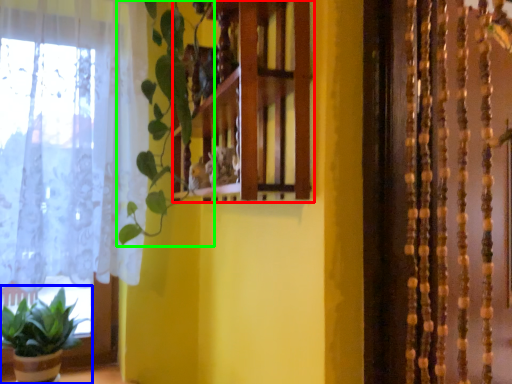
Question: Estimate the real-world distances between objects in this image. Which object is closer to shelf (highlighted by a red box), houseplant (highlighted by a blue box) or vegetation (highlighted by a green box)?

Choices:
 (A) houseplant
 (B) vegetation

Answer: (B)